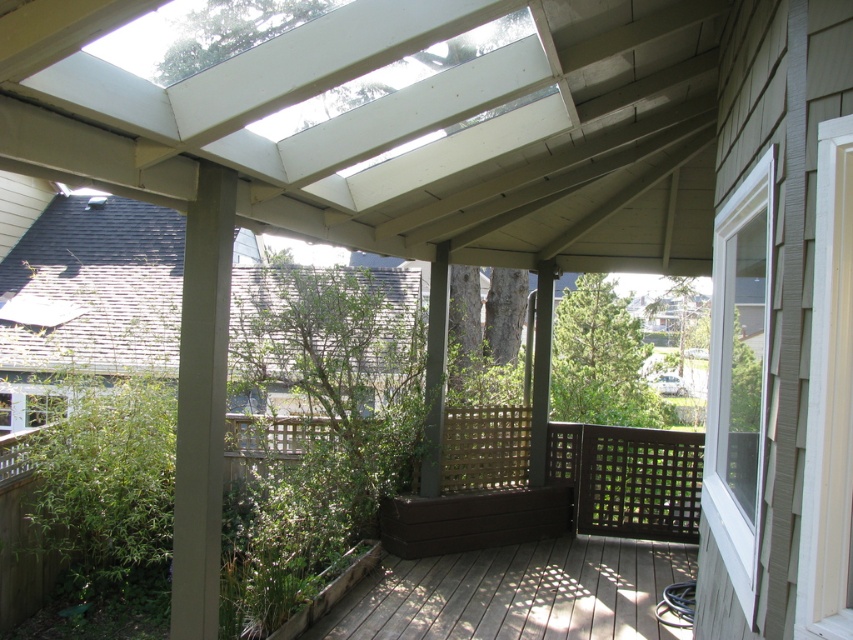
Question: Which of the following is the farthest from the observer?

Choices:
 (A) click(x=624, y=550)
 (B) click(x=706, y=436)
 (C) click(x=3, y=484)

Answer: (A)

Question: Observing the image, what is the correct spatial positioning of brown wood deck at lower center in reference to white plastic window at right?

Choices:
 (A) below
 (B) above

Answer: (A)

Question: Among these objects, which one is farthest from the camera?

Choices:
 (A) brown wood deck at lower center
 (B) white plastic window at right
 (C) brown wooden bench at center

Answer: (C)

Question: Does white plastic window at right appear on the right side of brown wooden bench at center?

Choices:
 (A) no
 (B) yes

Answer: (A)

Question: Does brown wood deck at lower center lie in front of brown wooden bench at center?

Choices:
 (A) no
 (B) yes

Answer: (B)

Question: Estimate the real-world distances between objects in this image. Which object is farther from the white plastic window at right?

Choices:
 (A) brown wood deck at lower center
 (B) brown wooden bench at center

Answer: (B)